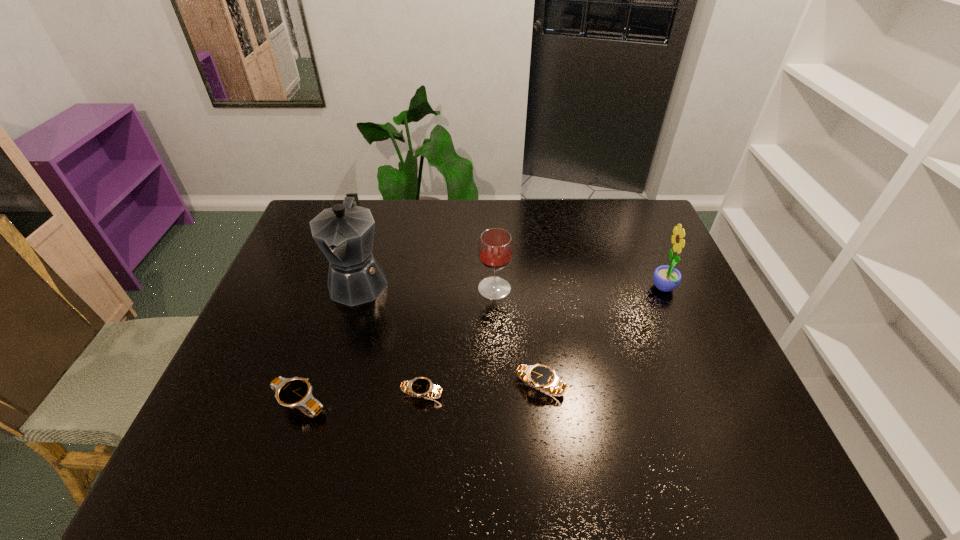
This screenshot has width=960, height=540. Find the location of `the fourth tallest object`. the fourth tallest object is located at coordinates (295, 392).

Where is `the leftmost watch`? The image size is (960, 540). the leftmost watch is located at coordinates (295, 392).

Where is `the second watch from left to right`? the second watch from left to right is located at coordinates (420, 386).

Locate an element on the screen. Image resolution: width=960 pixels, height=540 pixels. the shortest object is located at coordinates (420, 386).

The width and height of the screenshot is (960, 540). I want to click on the second tallest watch, so click(x=540, y=376).

This screenshot has width=960, height=540. I want to click on the rightmost watch, so 540,376.

The width and height of the screenshot is (960, 540). Identify the location of the fourth shortest object. (495, 248).

This screenshot has height=540, width=960. Identify the location of the tallest object. [345, 232].

Locate an element on the screen. This screenshot has height=540, width=960. sunflower is located at coordinates (666, 278).

Locate an element on the screen. The height and width of the screenshot is (540, 960). the fifth shortest object is located at coordinates (666, 278).